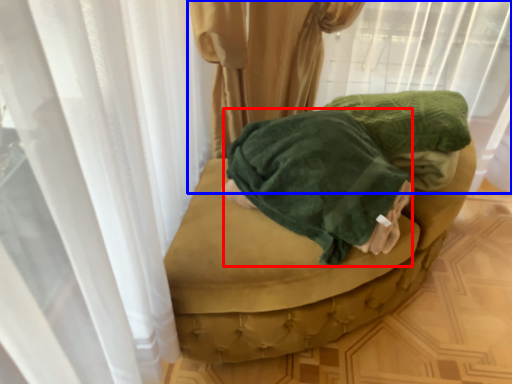
Question: Among these objects, which one is farthest to the camera, clothing (highlighted by a red box) or curtain (highlighted by a blue box)?

Choices:
 (A) clothing
 (B) curtain

Answer: (B)